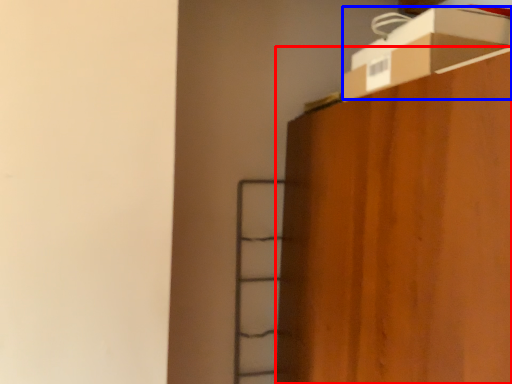
Question: Which of the following is the farthest to the observer, furniture (highlighted by a red box) or cardboard box (highlighted by a blue box)?

Choices:
 (A) furniture
 (B) cardboard box

Answer: (B)